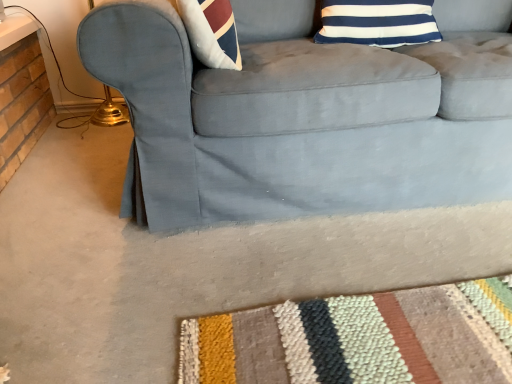
Question: Does point (345, 206) appear closer or farther from the camera than point (349, 39)?

Choices:
 (A) closer
 (B) farther

Answer: (A)

Question: In terms of size, does suede couch at center appear bigger or smaller than blue/white striped pillow at upper right?

Choices:
 (A) big
 (B) small

Answer: (A)

Question: Is suede couch at center taller or shorter than blue/white striped pillow at upper right?

Choices:
 (A) tall
 (B) short

Answer: (A)

Question: Visually, is blue/white striped pillow at upper right positioned to the left or to the right of suede couch at center?

Choices:
 (A) left
 (B) right

Answer: (A)

Question: Considering the positions of point (403, 8) and point (265, 129), is point (403, 8) closer or farther from the camera than point (265, 129)?

Choices:
 (A) closer
 (B) farther

Answer: (B)

Question: Is blue/white striped pillow at upper right inside or outside of suede couch at center?

Choices:
 (A) outside
 (B) inside

Answer: (B)

Question: From the image's perspective, is blue/white striped pillow at upper right positioned above or below suede couch at center?

Choices:
 (A) above
 (B) below

Answer: (A)